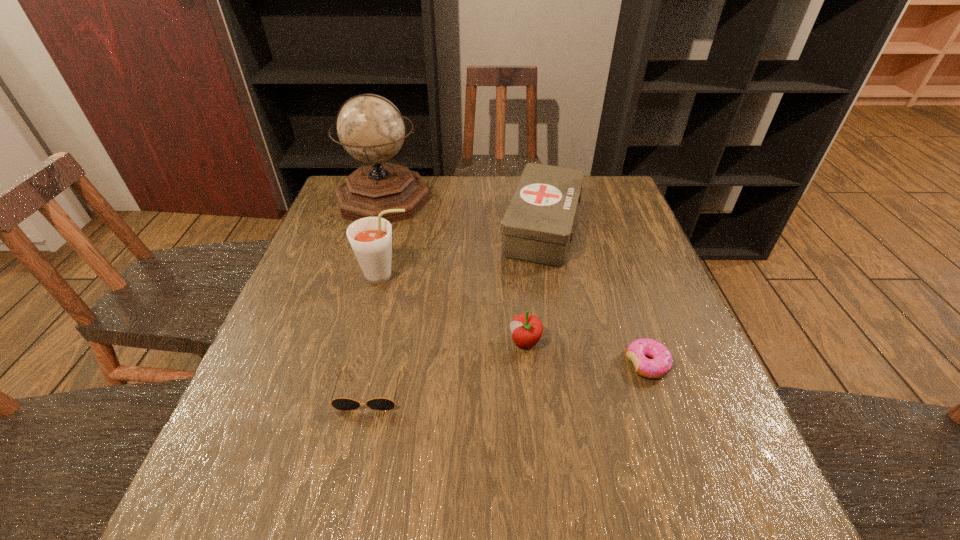
Where is `the third closest object relative to the third tallest object`? This screenshot has height=540, width=960. the third closest object relative to the third tallest object is located at coordinates (370, 238).

Locate an element on the screen. The width and height of the screenshot is (960, 540). object that is the fourth closest one to the root beer is located at coordinates (527, 329).

The width and height of the screenshot is (960, 540). I want to click on free space that satisfies the following two spatial constraints: 1. on the surface of the globe; 2. on the left side of the doughnut, so point(333,364).

The image size is (960, 540). In order to click on free space that satisfies the following two spatial constraints: 1. on the back side of the fourth tallest object; 2. on the drink side of the root beer in this screenshot , I will do `click(518, 276)`.

Find the location of a particular element. free space that satisfies the following two spatial constraints: 1. on the surface of the third tallest object; 2. on the left side of the tallest object is located at coordinates (374, 227).

Locate an element on the screen. free space that satisfies the following two spatial constraints: 1. on the front side of the fourth shortest object; 2. on the drink side of the root beer is located at coordinates (551, 276).

Where is `free space that satisfies the following two spatial constraints: 1. on the back side of the doughnut; 2. on the drink side of the second tallest object`? This screenshot has width=960, height=540. free space that satisfies the following two spatial constraints: 1. on the back side of the doughnut; 2. on the drink side of the second tallest object is located at coordinates (616, 276).

Identify the location of vacant position in the image that satisfies the following two spatial constraints: 1. on the drink side of the root beer; 2. on the left side of the doughnut. (364, 364).